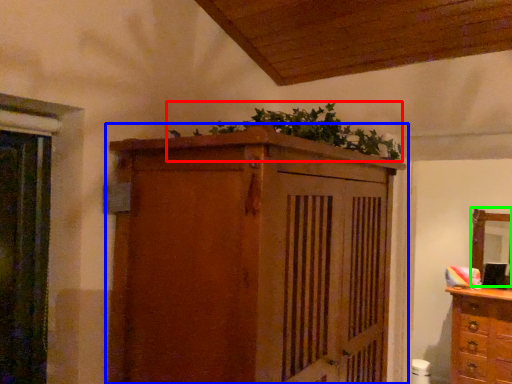
Question: Which object is the closest to the plant (highlighted by a red box)? Choose among these: cupboard (highlighted by a blue box) or mirror (highlighted by a green box).

Choices:
 (A) cupboard
 (B) mirror

Answer: (A)